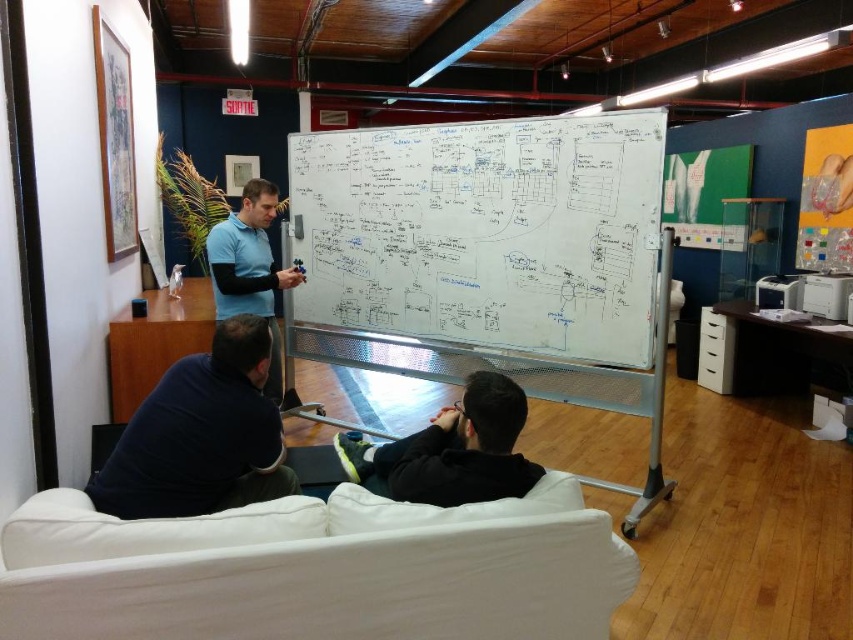
Question: In this image, where is black matte jacket at lower center located relative to blue cotton shirt at center?

Choices:
 (A) left
 (B) right

Answer: (B)

Question: Which object is positioned closest to the black matte jacket at lower center?

Choices:
 (A) blue cotton shirt at center
 (B) dark blue fabric at lower left
 (C) whiteboard at center

Answer: (B)

Question: Can you confirm if dark blue fabric at lower left is thinner than black matte jacket at lower center?

Choices:
 (A) no
 (B) yes

Answer: (B)

Question: From the image, what is the correct spatial relationship of whiteboard at center in relation to black matte jacket at lower center?

Choices:
 (A) above
 (B) below

Answer: (A)

Question: Estimate the real-world distances between objects in this image. Which object is closer to the whiteboard at center?

Choices:
 (A) black matte jacket at lower center
 (B) blue cotton shirt at center

Answer: (B)

Question: Among these objects, which one is farthest from the camera?

Choices:
 (A) dark blue fabric at lower left
 (B) black matte jacket at lower center
 (C) whiteboard at center
 (D) blue cotton shirt at center

Answer: (D)